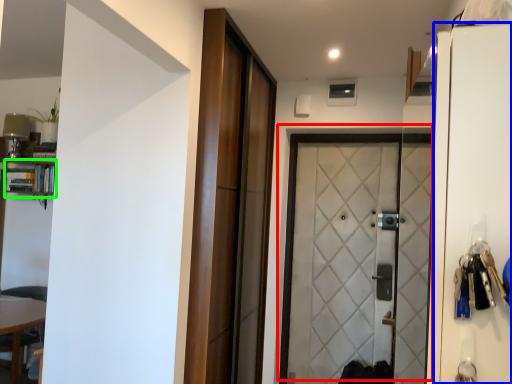
Question: Which object is the closest to the door (highlighted by a red box)? Choose among these: screen door (highlighted by a blue box) or bookshelf (highlighted by a green box).

Choices:
 (A) screen door
 (B) bookshelf

Answer: (B)